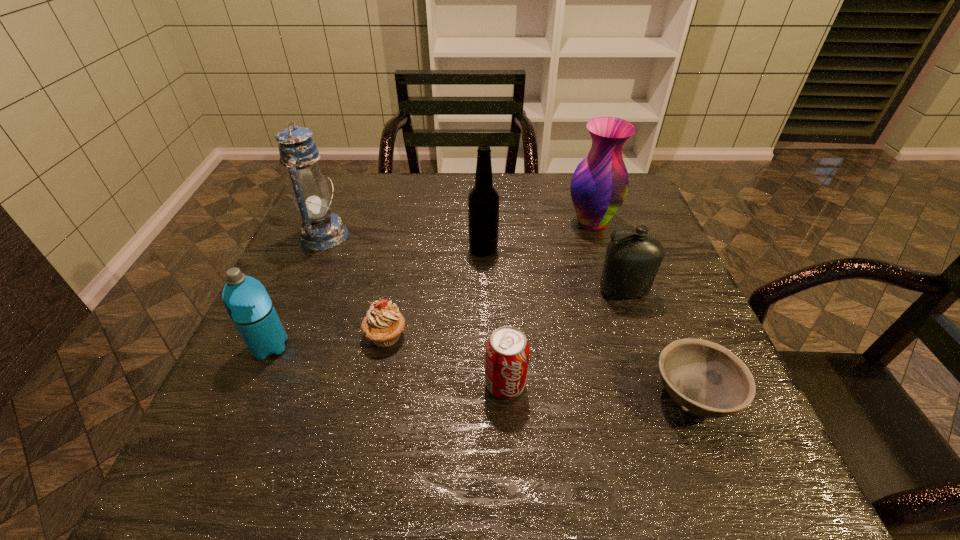
Find the location of a particular element. empty location between the thermos bottle and the bottle is located at coordinates (446, 319).

Identify the location of object that is the seventh nearest to the sixth tallest object. (320, 230).

Locate an element on the screen. This screenshot has width=960, height=540. object that is the second closest to the fifth nearest object is located at coordinates (704, 378).

You are a GUI agent. You are given a task and a screenshot of the screen. Output one action in this format:
    pyautogui.click(x=<x>, y=<y>)
    Task: Click on the free space that satisfies the following two spatial constraints: 1. on the front side of the shortest object; 2. on the right side of the thermos bottle
    The width and height of the screenshot is (960, 540).
    Given the screenshot: What is the action you would take?
    pyautogui.click(x=248, y=396)

This screenshot has height=540, width=960. I want to click on vacant region that satisfies the following two spatial constraints: 1. on the front side of the beer bottle; 2. on the left side of the shortest object, so click(485, 396).

Where is `free space that satisfies the following two spatial constraints: 1. on the front-facing side of the beer bottle; 2. on the right side of the lantern`? free space that satisfies the following two spatial constraints: 1. on the front-facing side of the beer bottle; 2. on the right side of the lantern is located at coordinates (319, 249).

Find the location of a particular element. The image size is (960, 540). free spot that satisfies the following two spatial constraints: 1. on the front side of the shortest object; 2. on the right side of the vase is located at coordinates (646, 396).